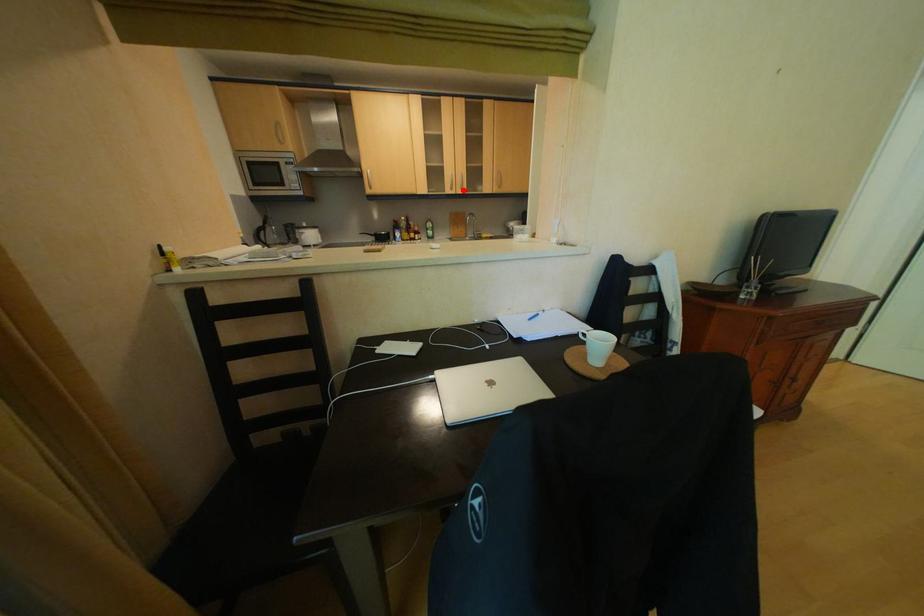
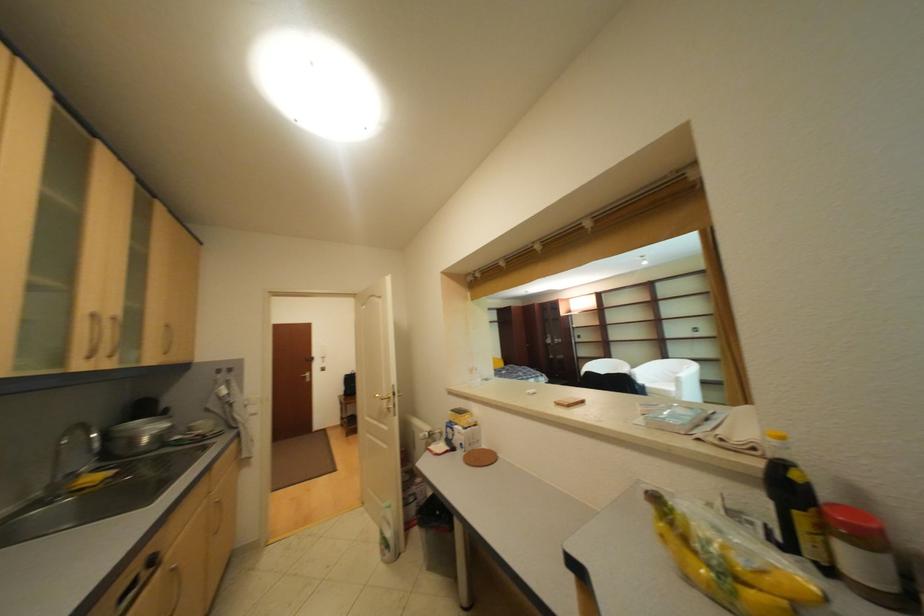
Where in the second image is the point corresponding to the highlighted location from the first image?

(101, 359)